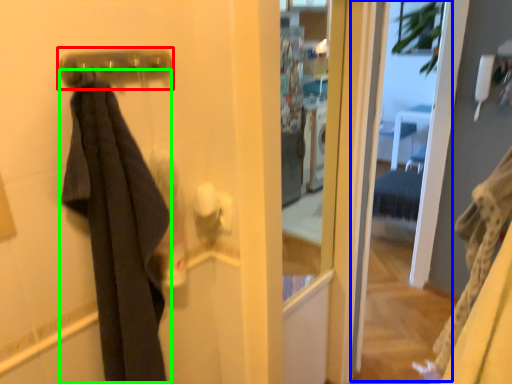
Question: Considering the real-world distances, which object is closest to door handle (highlighted by a red box)? screen door (highlighted by a blue box) or clothing (highlighted by a green box).

Choices:
 (A) screen door
 (B) clothing

Answer: (B)